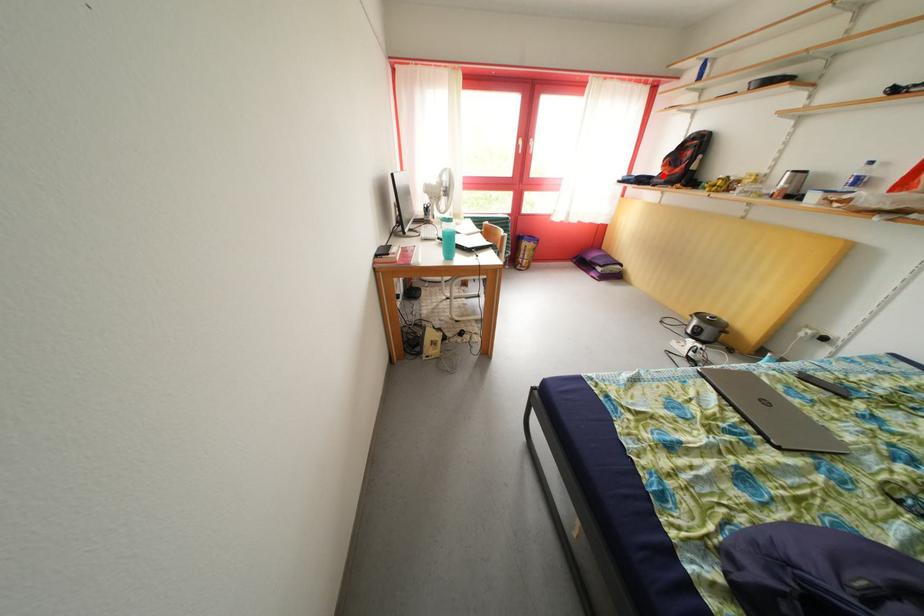
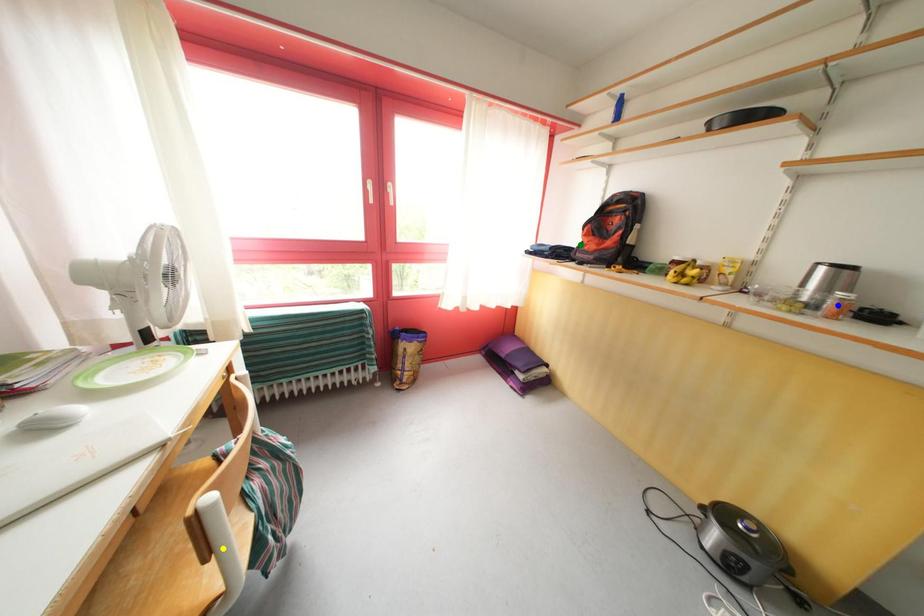
Question: I am providing you with two images of the same scene from different viewpoints. A red point is marked on the first image. You are given multiple points on the second image. Can you choose the point in image 2 that corresponds to the point in image 1?

Choices:
 (A) blue point
 (B) yellow point
 (C) green point

Answer: (C)